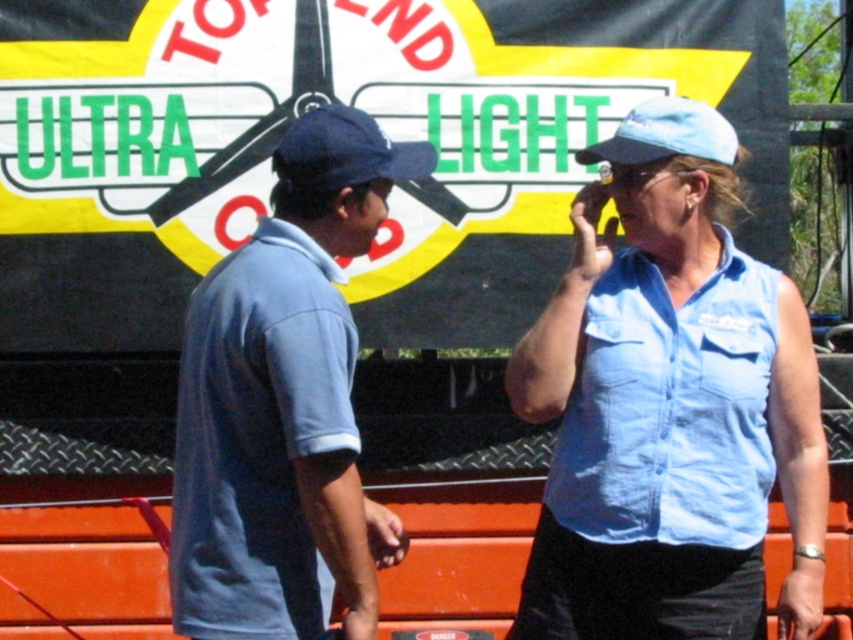
You are a photographer trying to capture a clear shot of both the light blue denim shirt at center and the blue fabric baseball cap at upper right. Since you want both subjects to be in focus, which one should you adjust your camera focus on first?

You should focus on the light blue denim shirt at center first because it is closer to the viewer than the blue fabric baseball cap at upper right. This ensures that the nearest subject is in focus, and the farther one will also be sharp due to depth of field.

You are designing a poster for an event and need to ensure that the two elements from the scene, the matte blue polo shirt at left and the blue fabric baseball cap at upper right, are scaled appropriately. Which one should you make larger in the poster to maintain the original scene proportions?

The matte blue polo shirt at left should be made larger in the poster since it is bigger than the blue fabric baseball cap at upper right in the original scene.